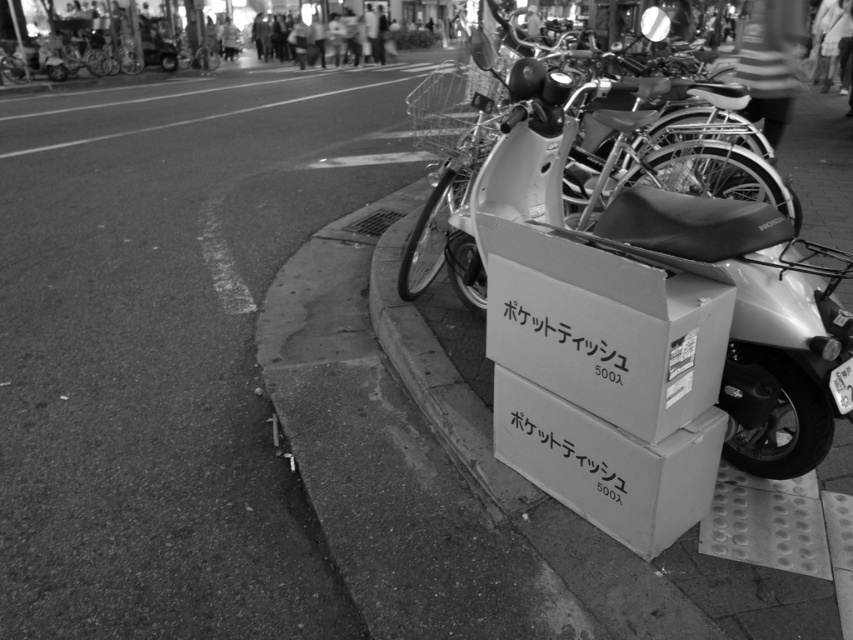
Question: Can you confirm if white cardboard box at center is smaller than white cardboard box at lower right?

Choices:
 (A) no
 (B) yes

Answer: (B)

Question: In this image, where is cardboard box at center located relative to white matte motorcycle at center?

Choices:
 (A) left
 (B) right

Answer: (B)

Question: Is white cardboard box at center to the right of white cardboard box at lower right from the viewer's perspective?

Choices:
 (A) no
 (B) yes

Answer: (A)

Question: Which point is closer to the camera?

Choices:
 (A) white cardboard box at lower right
 (B) white matte motorcycle at center
 (C) white cardboard box at center
 (D) cardboard box at center

Answer: (D)

Question: Among these objects, which one is farthest from the camera?

Choices:
 (A) cardboard box at center
 (B) white matte motorcycle at center

Answer: (B)

Question: Which object appears closest to the camera in this image?

Choices:
 (A) white cardboard box at lower right
 (B) white cardboard box at center
 (C) white matte motorcycle at center

Answer: (B)